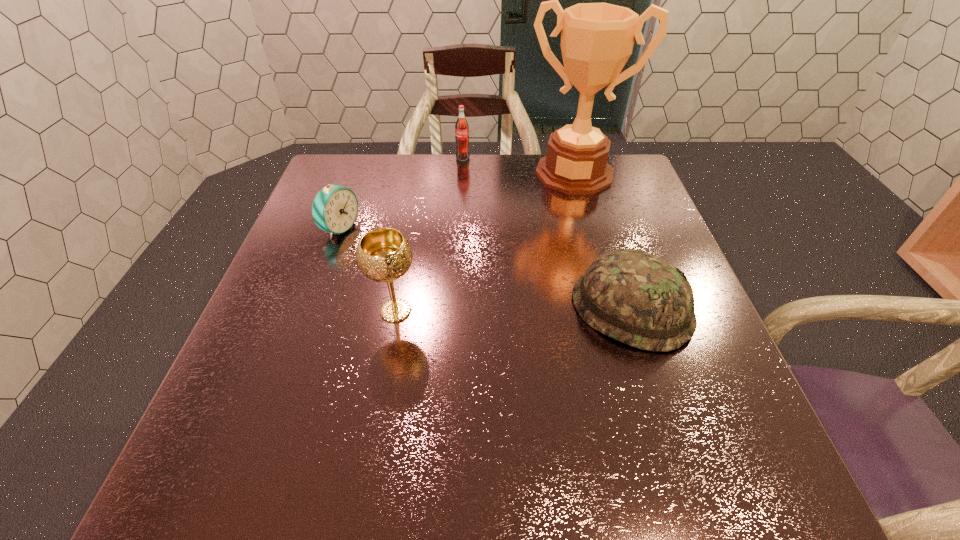
You are a GUI agent. You are given a task and a screenshot of the screen. Output one action in this format:
    pyautogui.click(x=<x>, y=<y>)
    Task: Click on the vacant area situated on the front-facing side of the alarm clock
    The height and width of the screenshot is (540, 960).
    Given the screenshot: What is the action you would take?
    pyautogui.click(x=411, y=260)

Image resolution: width=960 pixels, height=540 pixels. I want to click on blank space located 0.120m on the front-facing side of the alarm clock, so click(x=394, y=253).

Locate an element on the screen. vacant space located on the front-facing side of the tallest object is located at coordinates (540, 288).

This screenshot has width=960, height=540. Find the location of `free space located on the front-facing side of the tallest object`. free space located on the front-facing side of the tallest object is located at coordinates (551, 247).

Find the location of a particular element. blank space located on the front-facing side of the tallest object is located at coordinates pyautogui.click(x=547, y=261).

Find the location of a particular element. The height and width of the screenshot is (540, 960). vacant space located on the label of the third object from left to right is located at coordinates (473, 225).

Locate an element on the screen. This screenshot has height=540, width=960. free location located 0.150m on the label of the third object from left to right is located at coordinates (468, 190).

Where is `free region located on the label of the third object from left to right`? This screenshot has height=540, width=960. free region located on the label of the third object from left to right is located at coordinates (476, 244).

Where is `award at the far edge`? award at the far edge is located at coordinates (597, 39).

The height and width of the screenshot is (540, 960). I want to click on soda bottle that is at the far edge, so click(x=461, y=127).